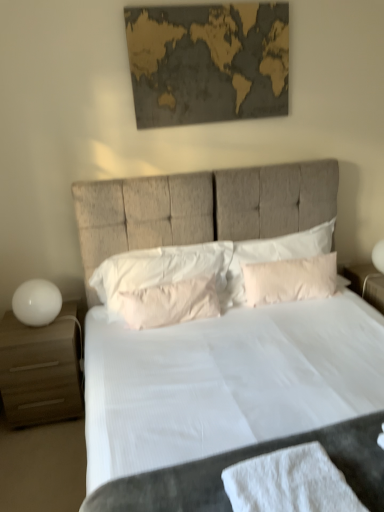
Question: Does pink fabric pillow at center, placed as the second pillow when sorted from left to right, have a greater width compared to white cotton bath towel at lower center?

Choices:
 (A) no
 (B) yes

Answer: (A)

Question: Can you confirm if pink fabric pillow at center, which appears as the second pillow when viewed from the right, is positioned to the right of white cotton bath towel at lower center?

Choices:
 (A) yes
 (B) no

Answer: (B)

Question: Is pink fabric pillow at center, placed as the second pillow when sorted from left to right, closer to camera compared to white cotton bath towel at lower center?

Choices:
 (A) yes
 (B) no

Answer: (B)

Question: From a real-world perspective, does pink fabric pillow at center, placed as the second pillow when sorted from left to right, stand above white cotton bath towel at lower center?

Choices:
 (A) yes
 (B) no

Answer: (A)

Question: Does pink fabric pillow at center, which appears as the second pillow when viewed from the right, contain white cotton bath towel at lower center?

Choices:
 (A) no
 (B) yes

Answer: (A)

Question: Is the depth of pink fabric pillow at center, which appears as the second pillow when viewed from the right, greater than that of white cotton bath towel at lower center?

Choices:
 (A) no
 (B) yes

Answer: (B)

Question: Considering the relative positions of gold textured map at upper center and pink fabric pillow at center, arranged as the first pillow when viewed from the right, in the image provided, is gold textured map at upper center to the left of pink fabric pillow at center, arranged as the first pillow when viewed from the right, from the viewer's perspective?

Choices:
 (A) yes
 (B) no

Answer: (A)

Question: Can you confirm if gold textured map at upper center is taller than pink fabric pillow at center, arranged as the first pillow when viewed from the right?

Choices:
 (A) yes
 (B) no

Answer: (A)

Question: Considering the relative sizes of gold textured map at upper center and pink fabric pillow at center, acting as the third pillow starting from the left, in the image provided, is gold textured map at upper center bigger than pink fabric pillow at center, acting as the third pillow starting from the left,?

Choices:
 (A) yes
 (B) no

Answer: (B)

Question: Is gold textured map at upper center surrounding pink fabric pillow at center, arranged as the first pillow when viewed from the right?

Choices:
 (A) yes
 (B) no

Answer: (B)

Question: Considering the relative sizes of gold textured map at upper center and pink fabric pillow at center, acting as the third pillow starting from the left, in the image provided, is gold textured map at upper center smaller than pink fabric pillow at center, acting as the third pillow starting from the left,?

Choices:
 (A) yes
 (B) no

Answer: (A)

Question: Could you tell me if gold textured map at upper center is facing pink fabric pillow at center, acting as the third pillow starting from the left?

Choices:
 (A) no
 (B) yes

Answer: (A)

Question: From the image's perspective, is white soft pillow at center, positioned as the first pillow in left-to-right order, above pink fabric pillow at center, arranged as the first pillow when viewed from the right?

Choices:
 (A) no
 (B) yes

Answer: (A)